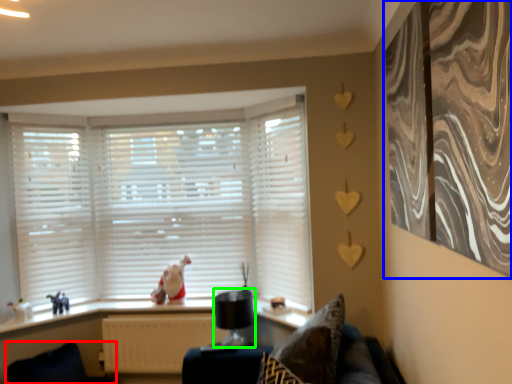
Question: Considering the real-world distances, which object is farthest from swivel chair (highlighted by a red box)? curtain (highlighted by a blue box) or lamp (highlighted by a green box)?

Choices:
 (A) curtain
 (B) lamp

Answer: (A)